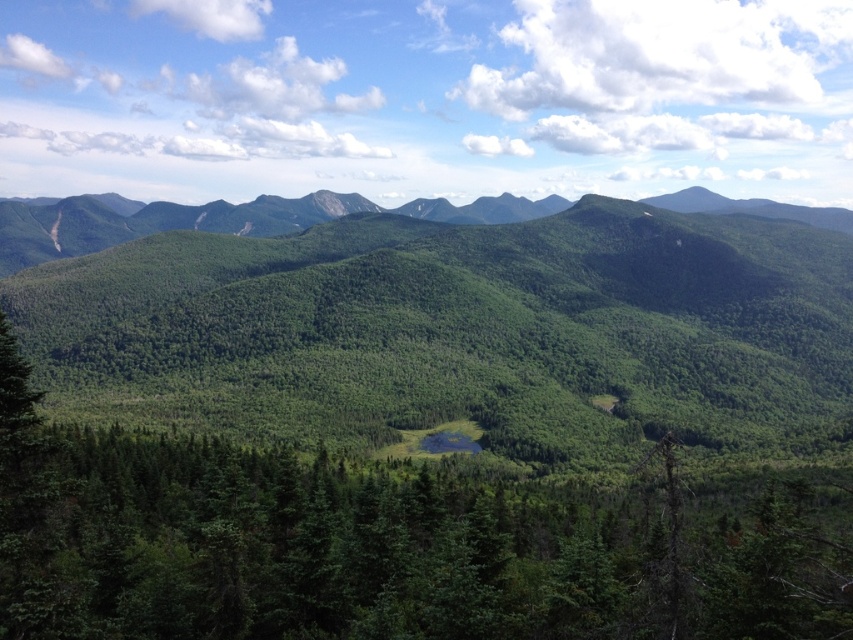
You are an environmental scientist studying the mountainous landscape. You observe the green forested mountain range at center and the green forested mountain range at upper center. Which mountain range is closer to the observer?

The green forested mountain range at center is closer to the observer because it is positioned under the green forested mountain range at upper center, indicating it is in front.

In the scene shown: You are standing at the camera position and want to reach the point marked at coordinates point (74,352). If you walk straight towards it, how far will you have to walk?

The point marked at coordinates point (74,352) is 246.54 meters away from the camera position, so you will have to walk 246.54 meters straight towards it to reach it.